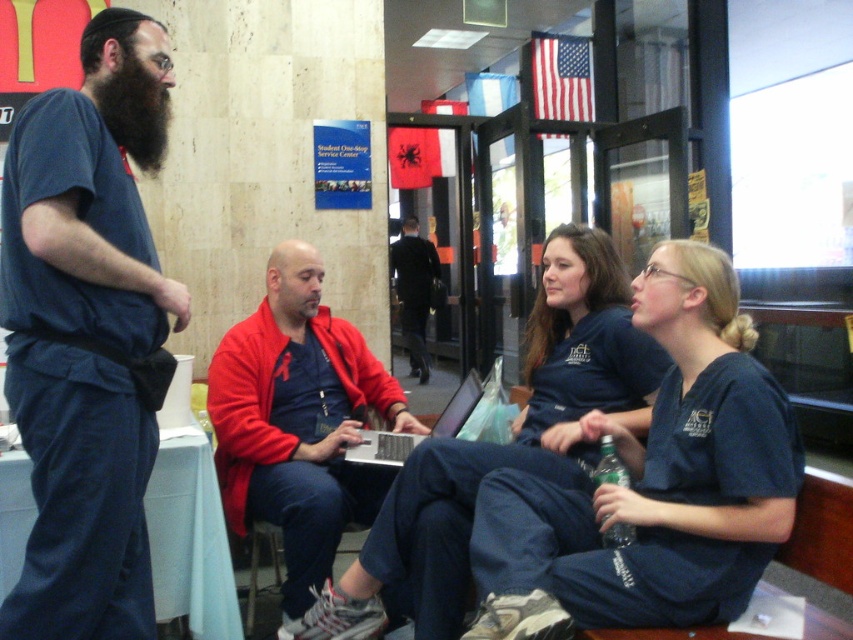
Does blue denim pants at center have a lesser height compared to dark blue suit at center?

Yes.

Who is more forward, (x=73, y=285) or (x=428, y=262)?

Point (x=73, y=285) is more forward.

This screenshot has width=853, height=640. Identify the location of blue denim pants at center. (88, 332).

The width and height of the screenshot is (853, 640). Identify the location of blue denim pants at center. (88, 332).

Consider the image. Does blue scrubs at center have a larger size compared to silver metallic laptop at center?

Yes, blue scrubs at center is bigger than silver metallic laptop at center.

Which is behind, point (608, 525) or point (444, 424)?

Positioned behind is point (444, 424).

The height and width of the screenshot is (640, 853). I want to click on blue scrubs at center, so click(654, 483).

Does dark blue suit at center appear on the right side of silver metallic laptop at center?

Answer: Incorrect, dark blue suit at center is not on the right side of silver metallic laptop at center.

Can you confirm if dark blue suit at center is smaller than silver metallic laptop at center?

Incorrect, dark blue suit at center is not smaller in size than silver metallic laptop at center.

Does point (418, 330) come behind point (404, 460)?

Yes.

Locate an element on the screen. The height and width of the screenshot is (640, 853). dark blue suit at center is located at coordinates (415, 291).